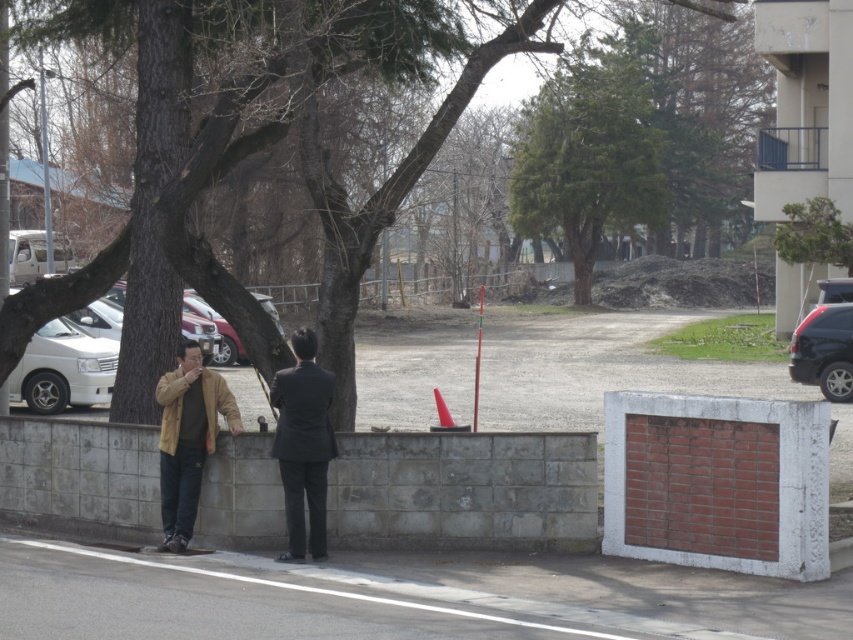
Question: Among these points, which one is farthest from the camera?

Choices:
 (A) (242, 145)
 (B) (50, 388)
 (C) (276, 401)

Answer: (B)

Question: Considering the real-world distances, which object is closest to the dark gray suit at center?

Choices:
 (A) gray concrete wall at center
 (B) green leafy tree at center
 (C) white matte van at left
 (D) matte brown jacket at center

Answer: (D)

Question: Can you confirm if matte brown jacket at center is positioned to the left of dark gray suit at center?

Choices:
 (A) yes
 (B) no

Answer: (A)

Question: Which is nearer to the shiny black suv at right?

Choices:
 (A) gray concrete wall at center
 (B) brown bark tree at center
 (C) green leafy tree at center
 (D) matte brown jacket at center

Answer: (B)

Question: Can you confirm if matte brown jacket at left is positioned above white matte van at left?

Choices:
 (A) no
 (B) yes

Answer: (A)

Question: Is matte brown jacket at left wider than white matte van at left?

Choices:
 (A) yes
 (B) no

Answer: (B)